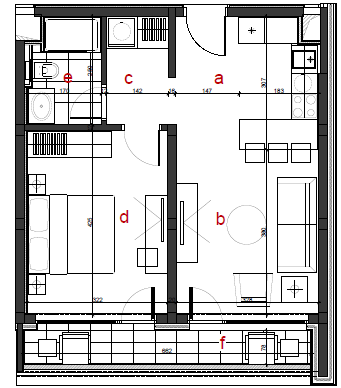
Where is `toilet`? toilet is located at coordinates (45, 70).